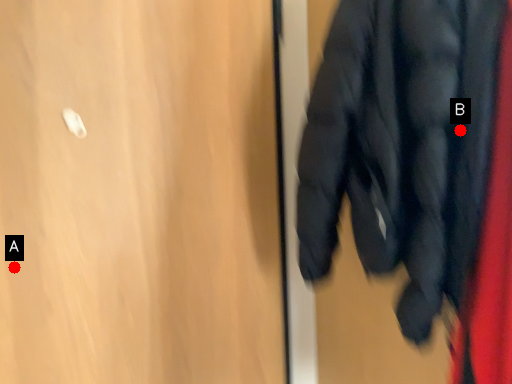
Question: Two points are circled on the image, labeled by A and B beside each circle. Which point is closer to the camera?

Choices:
 (A) A is closer
 (B) B is closer

Answer: (B)